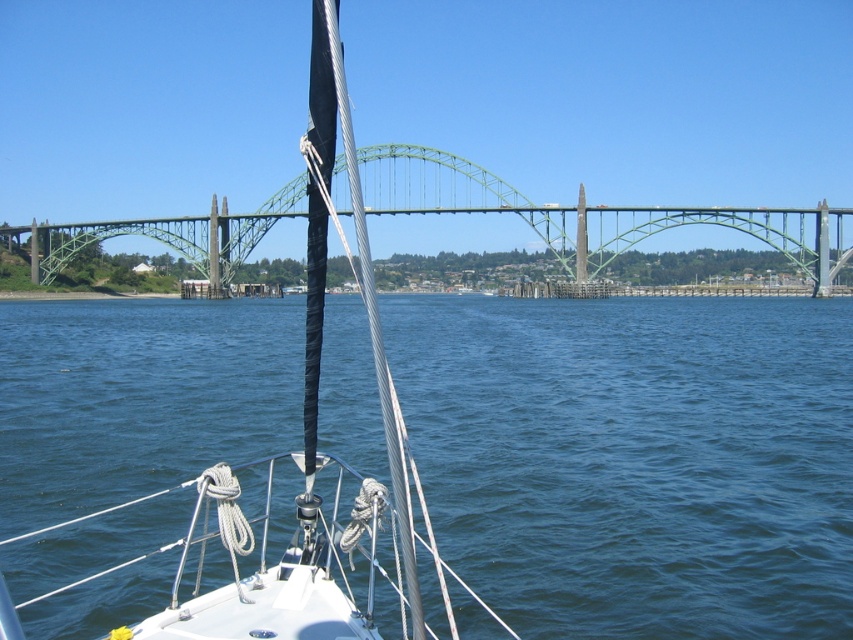
Question: Among these objects, which one is farthest from the camera?

Choices:
 (A) blue water at center
 (B) white matte sailboat at center
 (C) green metallic bridge at center

Answer: (C)

Question: Which of the following is the farthest from the observer?

Choices:
 (A) white matte sailboat at center
 (B) blue water at center
 (C) green metallic bridge at center

Answer: (C)

Question: Is white matte sailboat at center closer to camera compared to green metallic bridge at center?

Choices:
 (A) yes
 (B) no

Answer: (A)

Question: Can you confirm if white matte sailboat at center is positioned to the right of green metallic bridge at center?

Choices:
 (A) yes
 (B) no

Answer: (B)

Question: Does blue water at center have a larger size compared to green metallic bridge at center?

Choices:
 (A) yes
 (B) no

Answer: (B)

Question: Which point is closer to the camera taking this photo?

Choices:
 (A) (737, 488)
 (B) (339, 632)
 (C) (106, 224)

Answer: (B)